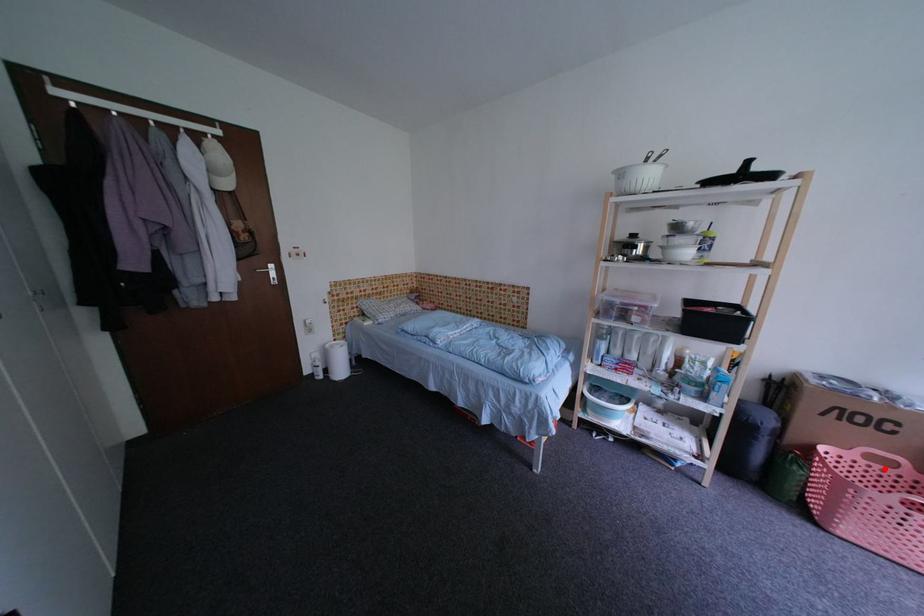
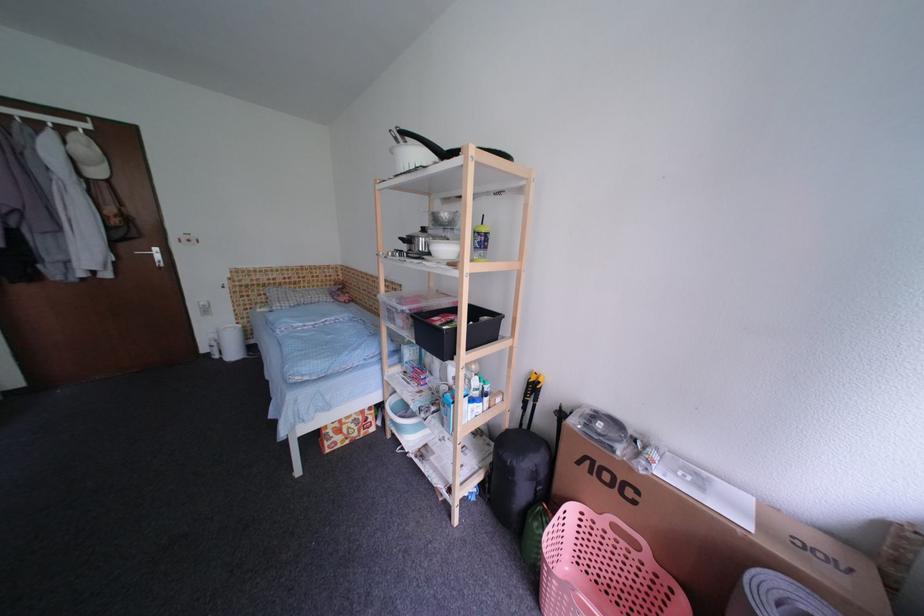
Question: A red point is marked in image1. In image2, is the corresponding 3D point closer to the camera or farther? Reply with the corresponding letter.

Choices:
 (A) The corresponding 3D point is closer.
 (B) The corresponding 3D point is farther.

Answer: (A)